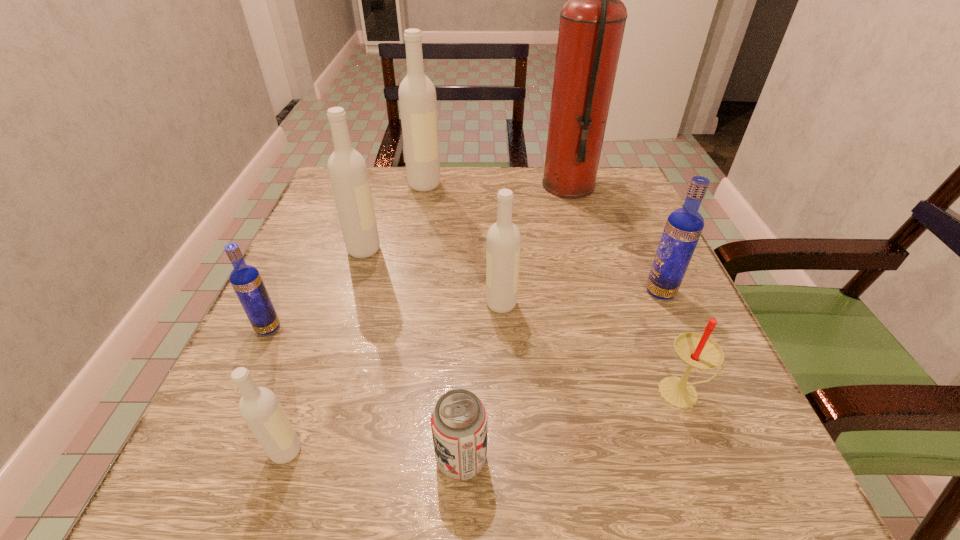
Where is `free point that satisfies the following two spatial constraints: 1. on the front side of the bigger blue vodka; 2. on the left side of the second tallest object`? free point that satisfies the following two spatial constraints: 1. on the front side of the bigger blue vodka; 2. on the left side of the second tallest object is located at coordinates (406, 292).

In order to click on vacant area in the image that satisfies the following two spatial constraints: 1. at the nozzle of the tallest object; 2. on the back side of the rightmost vodka in this screenshot , I will do `click(599, 292)`.